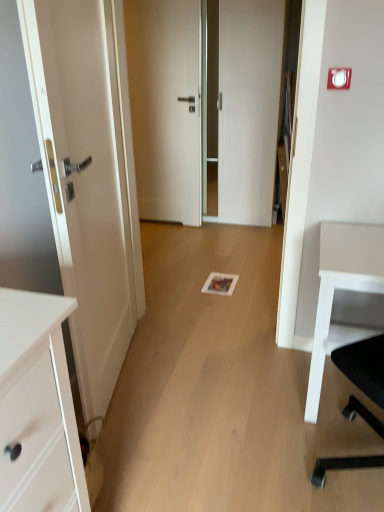
Question: Is the position of white glossy door at left, the 3th door from the back, more distant than that of white glossy door at center, marked as the second door in a back-to-front arrangement?

Choices:
 (A) no
 (B) yes

Answer: (A)

Question: From a real-world perspective, is white glossy door at left, the 3th door from the back, on white glossy door at center, placed as the 2th door when sorted from front to back?

Choices:
 (A) no
 (B) yes

Answer: (A)

Question: From the image's perspective, does white glossy door at left, the 3th door from the back, appear higher than white glossy door at center, marked as the second door in a back-to-front arrangement?

Choices:
 (A) yes
 (B) no

Answer: (B)

Question: Considering the relative sizes of white glossy door at left, the 3th door from the back, and white glossy door at center, marked as the second door in a back-to-front arrangement, in the image provided, is white glossy door at left, the 3th door from the back, smaller than white glossy door at center, marked as the second door in a back-to-front arrangement,?

Choices:
 (A) no
 (B) yes

Answer: (B)

Question: Is white glossy door at center, placed as the 2th door when sorted from front to back, a part of white glossy door at left, positioned as the 1th door in front-to-back order?

Choices:
 (A) yes
 (B) no

Answer: (B)

Question: Does white glossy door at left, the 3th door from the back, appear on the left side of white glossy door at center, marked as the second door in a back-to-front arrangement?

Choices:
 (A) yes
 (B) no

Answer: (A)

Question: Considering the relative sizes of white glossy door at center, marked as the second door in a back-to-front arrangement, and white matte desk at right in the image provided, is white glossy door at center, marked as the second door in a back-to-front arrangement, smaller than white matte desk at right?

Choices:
 (A) yes
 (B) no

Answer: (B)

Question: Does white glossy door at center, marked as the second door in a back-to-front arrangement, contain white matte desk at right?

Choices:
 (A) yes
 (B) no

Answer: (B)

Question: Does white glossy door at center, placed as the 2th door when sorted from front to back, have a greater height compared to white matte desk at right?

Choices:
 (A) no
 (B) yes

Answer: (B)

Question: Can we say white glossy door at center, placed as the 2th door when sorted from front to back, lies outside white matte desk at right?

Choices:
 (A) yes
 (B) no

Answer: (A)

Question: From the image's perspective, does white glossy door at center, marked as the second door in a back-to-front arrangement, appear lower than white matte desk at right?

Choices:
 (A) no
 (B) yes

Answer: (A)

Question: Is white glossy door at center, marked as the second door in a back-to-front arrangement, at the left side of white matte desk at right?

Choices:
 (A) yes
 (B) no

Answer: (A)

Question: Is white matte door at center, the first door in the back-to-front sequence, thinner than white matte desk at right?

Choices:
 (A) yes
 (B) no

Answer: (A)